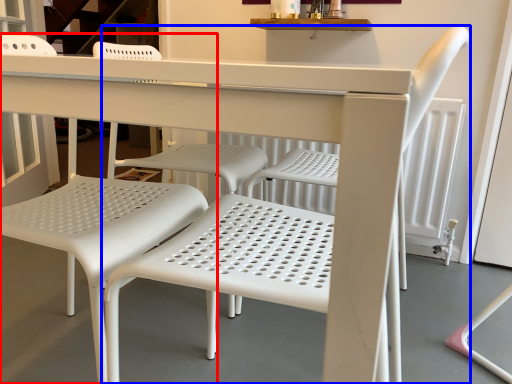
Question: Among these objects, which one is farthest to the camera, chair (highlighted by a red box) or chair (highlighted by a blue box)?

Choices:
 (A) chair
 (B) chair

Answer: (A)